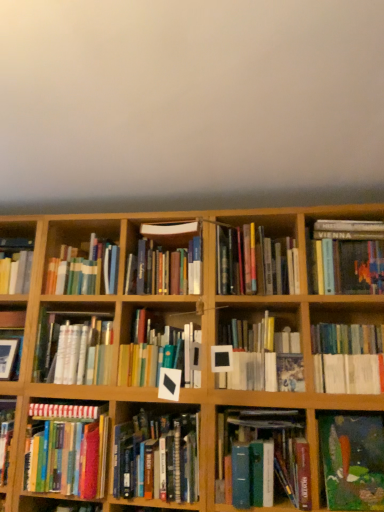
Question: Which is correct: hardcover books at center, the 6th book when ordered from right to left, is inside hardcover books at center right, the 12th book positioned from the left, or outside of it?

Choices:
 (A) inside
 (B) outside

Answer: (B)

Question: From a real-world perspective, relative to hardcover books at center right, the 12th book positioned from the left, is hardcover books at center, the 8th book positioned from the left, vertically above or below?

Choices:
 (A) below
 (B) above

Answer: (A)

Question: Considering the real-world distances, which object is closest to the hardcover books at center, marked as the sixth book in a left-to-right arrangement?

Choices:
 (A) hardcover books at center, the 6th book when ordered from right to left
 (B) white matte book at center, the ninth book viewed from the left
 (C) oil painting at lower right, which is the third book in right-to-left order
 (D) hardcover books at left, marked as the twelfth book in a right-to-left arrangement
 (E) hardcover books at center, which is the tenth book from left to right

Answer: (B)

Question: Which of these objects is positioned farthest from the hardcover books at center, the 6th book when ordered from right to left?

Choices:
 (A) hardcover books at center left, which is counted as the fourth book, starting from the left
 (B) white matte book at center, arranged as the fifth book when viewed from the right
 (C) oil painting at lower right, the 11th book in the left-to-right sequence
 (D) hardcover book at left, placed as the 1th book when sorted from left to right
 (E) hardcover books at center right, acting as the 2th book starting from the right

Answer: (D)